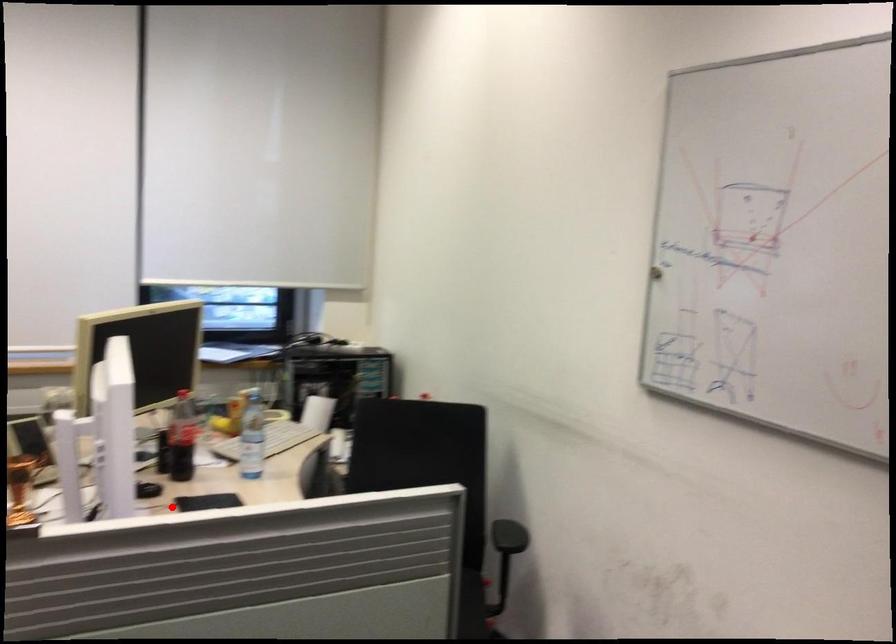
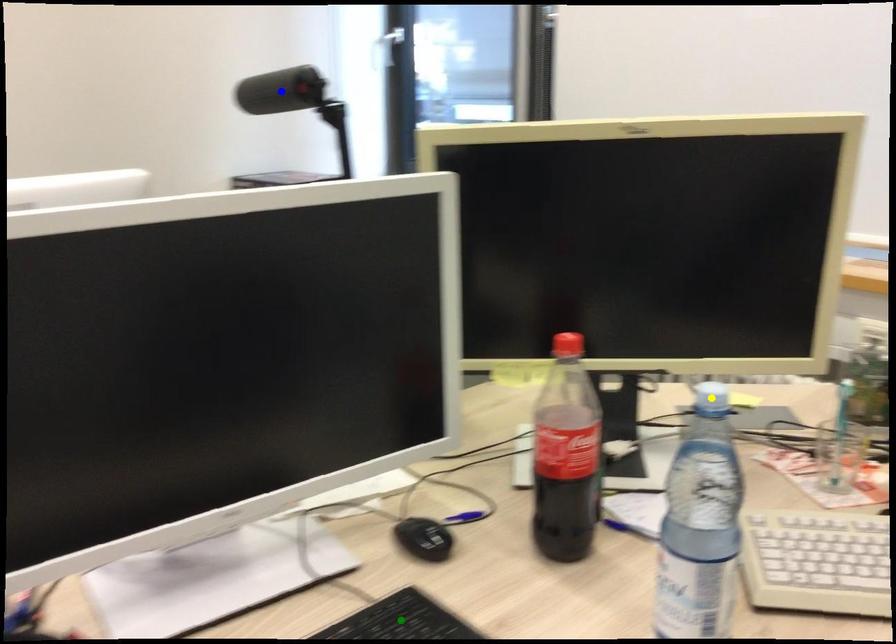
Question: I am providing you with two images of the same scene from different viewpoints. A red point is marked on the first image. You are given multiple points on the second image. Which mark in image 2 goes with the point in image 1?

Choices:
 (A) blue point
 (B) yellow point
 (C) green point

Answer: (C)